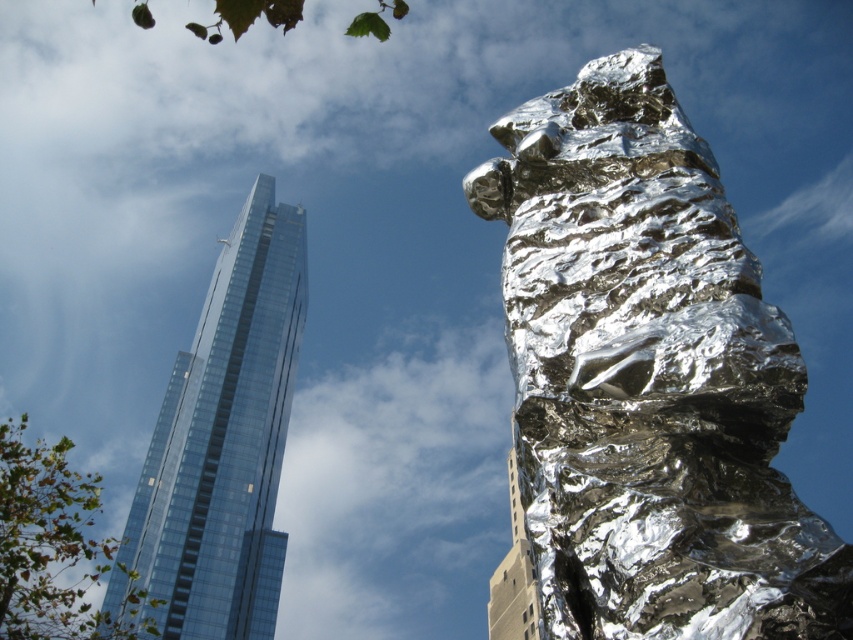
Question: Can you confirm if shiny metallic rock at center is positioned above transparent glass skyscraper at upper left?

Choices:
 (A) yes
 (B) no

Answer: (A)

Question: Based on their relative distances, which object is nearer to the shiny metallic rock at center?

Choices:
 (A) transparent glass skyscraper at upper left
 (B) beige concrete building at center

Answer: (A)

Question: Does shiny metallic rock at center lie in front of beige concrete building at center?

Choices:
 (A) yes
 (B) no

Answer: (A)

Question: Among these objects, which one is nearest to the camera?

Choices:
 (A) transparent glass skyscraper at upper left
 (B) beige concrete building at center

Answer: (A)

Question: Considering the relative positions of shiny metallic rock at center and beige concrete building at center in the image provided, where is shiny metallic rock at center located with respect to beige concrete building at center?

Choices:
 (A) above
 (B) below

Answer: (A)

Question: Which point is closer to the camera?

Choices:
 (A) (844, 605)
 (B) (294, 300)

Answer: (A)